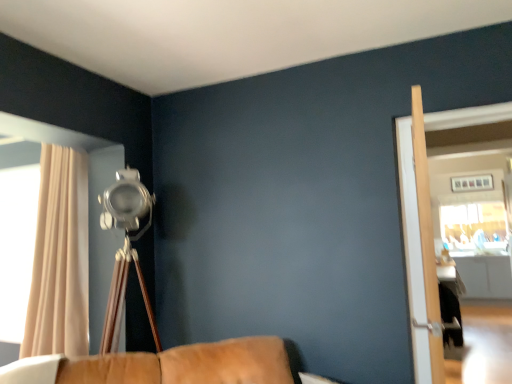
Question: Is brown leather couch at lower center smaller than beige fabric curtain at left?

Choices:
 (A) no
 (B) yes

Answer: (A)

Question: Is brown leather couch at lower center to the right of beige fabric curtain at left from the viewer's perspective?

Choices:
 (A) yes
 (B) no

Answer: (A)

Question: Does brown leather couch at lower center have a lesser height compared to beige fabric curtain at left?

Choices:
 (A) no
 (B) yes

Answer: (B)

Question: Is brown leather couch at lower center oriented away from beige fabric curtain at left?

Choices:
 (A) yes
 (B) no

Answer: (B)

Question: From the image's perspective, is brown leather couch at lower center below beige fabric curtain at left?

Choices:
 (A) yes
 (B) no

Answer: (A)

Question: Considering the relative positions of beige fabric curtain at left and brown leather couch at lower center in the image provided, is beige fabric curtain at left to the left or to the right of brown leather couch at lower center?

Choices:
 (A) left
 (B) right

Answer: (A)

Question: From the image's perspective, is beige fabric curtain at left above or below brown leather couch at lower center?

Choices:
 (A) below
 (B) above

Answer: (B)

Question: Is beige fabric curtain at left taller or shorter than brown leather couch at lower center?

Choices:
 (A) tall
 (B) short

Answer: (A)

Question: Which is correct: beige fabric curtain at left is inside brown leather couch at lower center, or outside of it?

Choices:
 (A) outside
 (B) inside

Answer: (A)

Question: Considering the relative positions of light wood screen door at right, the 1th screen door when ordered from left to right, and beige fabric curtain at left in the image provided, is light wood screen door at right, the 1th screen door when ordered from left to right, to the left or to the right of beige fabric curtain at left?

Choices:
 (A) left
 (B) right

Answer: (B)

Question: Is light wood screen door at right, which is the second screen door from right to left, in front of or behind beige fabric curtain at left in the image?

Choices:
 (A) front
 (B) behind

Answer: (A)

Question: Is light wood screen door at right, the 1th screen door when ordered from left to right, wider or thinner than beige fabric curtain at left?

Choices:
 (A) thin
 (B) wide

Answer: (A)

Question: Is light wood screen door at right, which is the second screen door from right to left, taller or shorter than beige fabric curtain at left?

Choices:
 (A) tall
 (B) short

Answer: (B)

Question: In terms of size, does beige fabric curtain at left appear bigger or smaller than light wood screen door at right, which is the second screen door from right to left?

Choices:
 (A) small
 (B) big

Answer: (B)

Question: From a real-world perspective, is beige fabric curtain at left positioned above or below light wood screen door at right, the 1th screen door when ordered from left to right?

Choices:
 (A) below
 (B) above

Answer: (B)